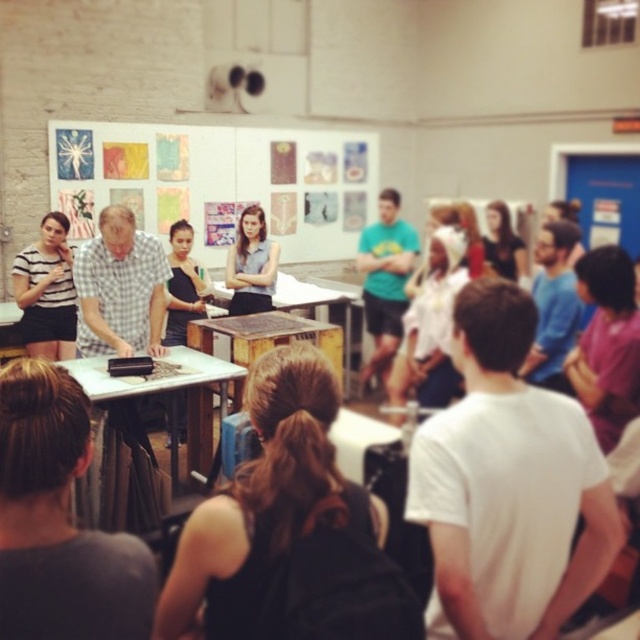
Who is positioned more to the right, striped fabric shirt at left or matte gray shirt at center?

matte gray shirt at center is more to the right.

Find the location of `striped fabric shirt at left`. striped fabric shirt at left is located at coordinates (45, 291).

Consider the image. Does wooden table at center appear on the right side of striped fabric shirt at left?

Correct, you'll find wooden table at center to the right of striped fabric shirt at left.

This screenshot has width=640, height=640. Identify the location of wooden table at center. click(131, 442).

Describe the element at coordinates (131, 442) in the screenshot. I see `wooden table at center` at that location.

At what (x,y) coordinates should I click in order to perform the action: click on wooden table at center. Please return your answer as a coordinate pair (x, y). The image size is (640, 640). Looking at the image, I should click on (131, 442).

Can you confirm if checkered fabric shirt at center is shorter than matte gray shirt at center?

Indeed, checkered fabric shirt at center has a lesser height compared to matte gray shirt at center.

Can you confirm if checkered fabric shirt at center is positioned to the right of matte gray shirt at center?

In fact, checkered fabric shirt at center is to the left of matte gray shirt at center.

Is point (131, 280) positioned in front of point (272, 256)?

Yes, it is.

What are the coordinates of `checkered fabric shirt at center` in the screenshot? It's located at (120, 289).